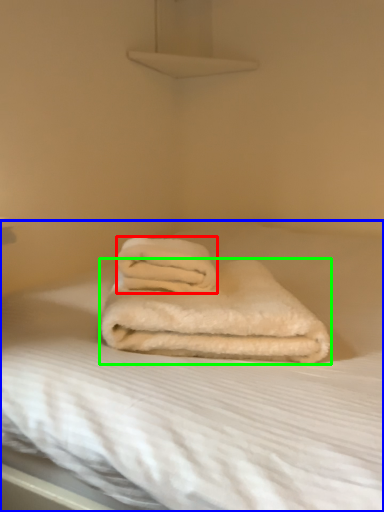
Question: Estimate the real-world distances between objects in this image. Which object is farther from towel (highlighted by a red box), bed (highlighted by a blue box) or towel (highlighted by a green box)?

Choices:
 (A) bed
 (B) towel

Answer: (A)